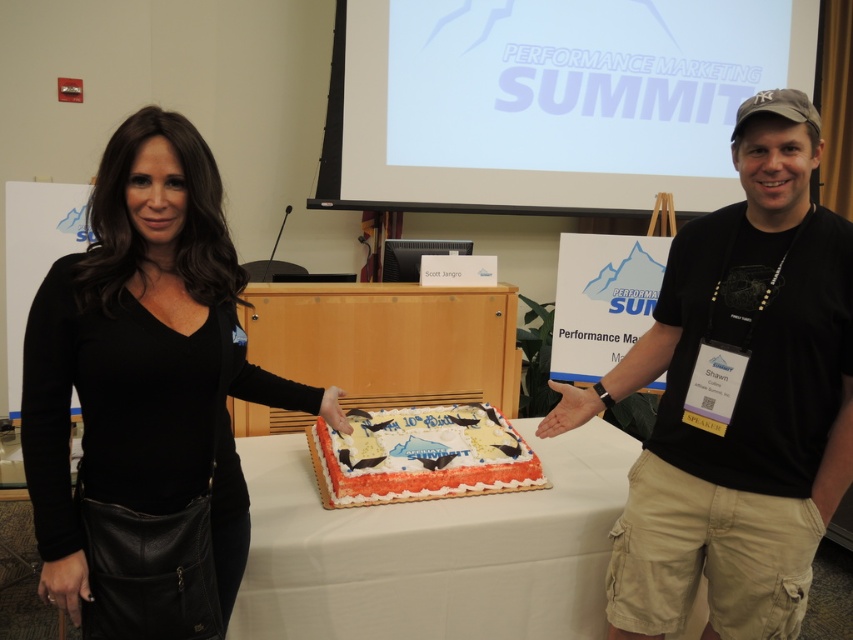
You are organizing a photo shoot for a fashion magazine and need to ensure that the black leather jacket at center can be fully displayed on the white paper table at center. Can the jacket fit on the table without overlapping the edges?

The black leather jacket at center has a lesser width compared to the white paper table at center, so it can fit without overlapping the edges.